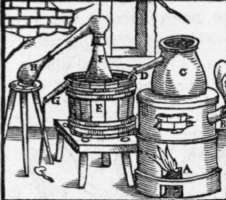
Identify the location of window. (123, 17).